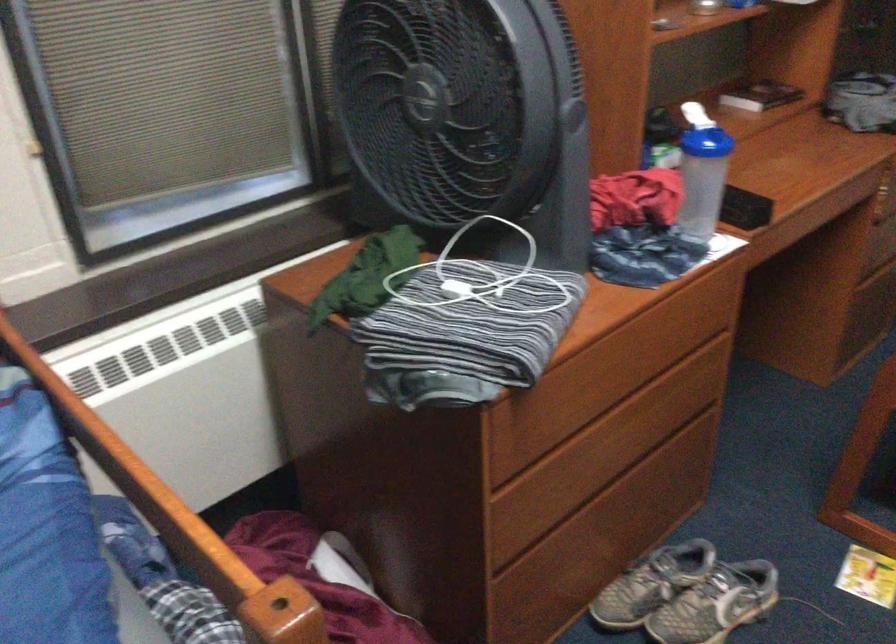
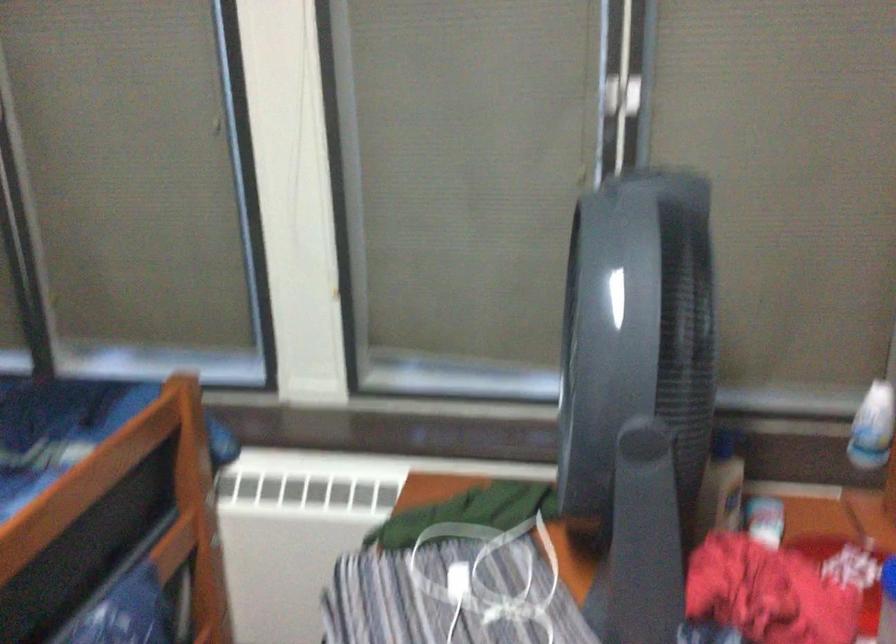
Question: The camera is either moving clockwise (left) or counter-clockwise (right) around the object. The first image is from the beginning of the video and the second image is from the end. Is the camera moving left or right when shooting the video?

Choices:
 (A) Left
 (B) Right

Answer: (B)